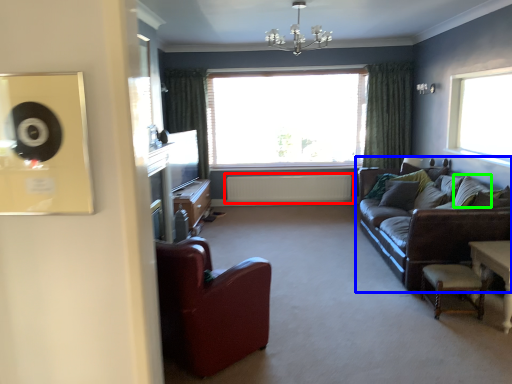
Question: Which object is the closest to the radiator (highlighted by a red box)? Choose among these: studio couch (highlighted by a blue box) or pillow (highlighted by a green box).

Choices:
 (A) studio couch
 (B) pillow

Answer: (A)